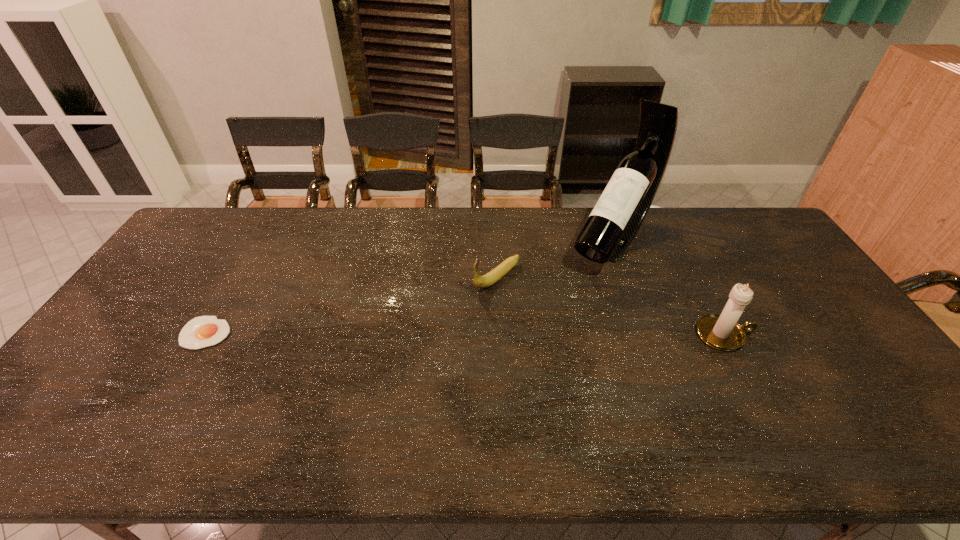
Identify which object is located as the second nearest to the third shortest object. Please provide its 2D coordinates. Your answer should be formatted as a tuple, i.e. [(x, y)], where the tuple contains the x and y coordinates of a point satisfying the conditions above.

[(496, 274)]

Locate an element on the screen. The image size is (960, 540). object that ranks as the closest to the candle holder is located at coordinates (620, 211).

The height and width of the screenshot is (540, 960). What are the coordinates of `free space that satisfies the following two spatial constraints: 1. on the front side of the wine bottle; 2. on the handle side of the candle holder` in the screenshot? It's located at (647, 335).

The width and height of the screenshot is (960, 540). I want to click on free location that satisfies the following two spatial constraints: 1. on the back side of the shortest object; 2. on the right side of the wine bottle, so click(x=260, y=240).

This screenshot has width=960, height=540. What are the coordinates of `free space that satisfies the following two spatial constraints: 1. on the front side of the second tallest object; 2. on the handle side of the leftmost object` in the screenshot? It's located at (204, 335).